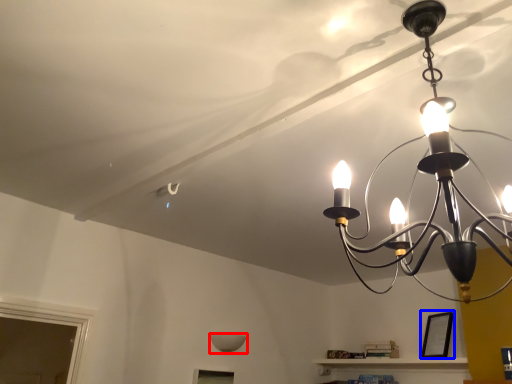
Question: Which object appears closest to the camera in this image, lamp (highlighted by a red box) or picture frame (highlighted by a blue box)?

Choices:
 (A) lamp
 (B) picture frame

Answer: (B)